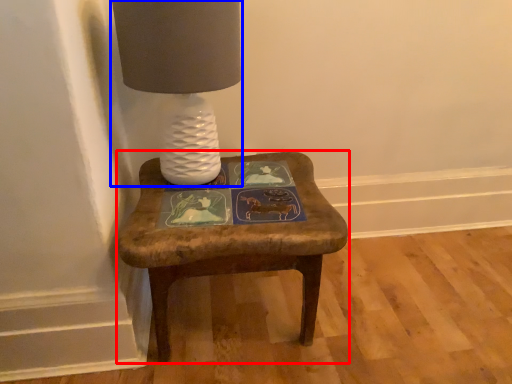
Question: Which point is closer to the camera, stool (highlighted by a red box) or table lamp (highlighted by a blue box)?

Choices:
 (A) stool
 (B) table lamp

Answer: (B)